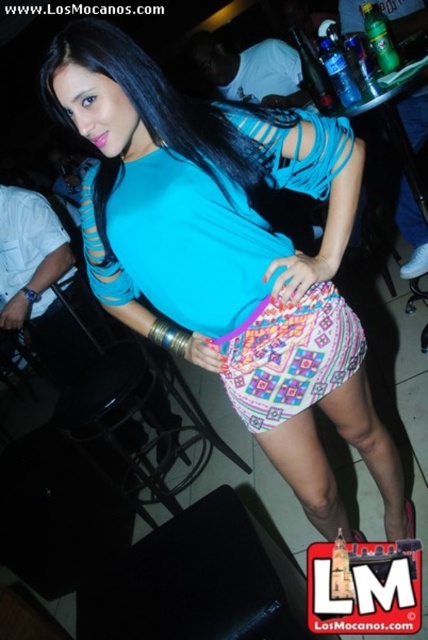
What are the coordinates of the matte blue top at center?

The matte blue top at center is located at point (196, 198).

You are a photographer trying to capture the woman in the center of the image. You notice two points marked in the scene, one at point (275, 234) and another at point (237, 122). Which point is closer to the camera?

A: Point (275, 234) is closer to the camera than point (237, 122) because it is further to the camera than the other point.